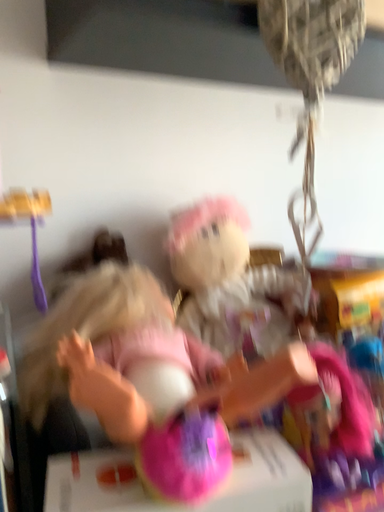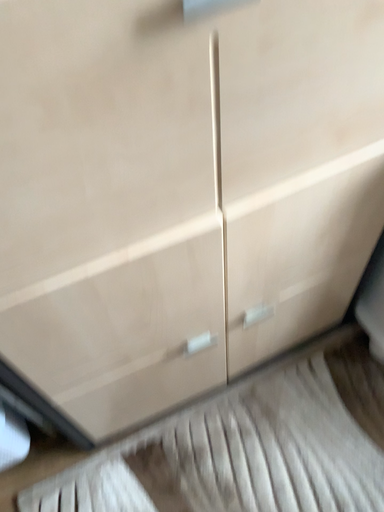
Question: How did the camera likely rotate when shooting the video?

Choices:
 (A) rotated upward
 (B) rotated downward

Answer: (B)